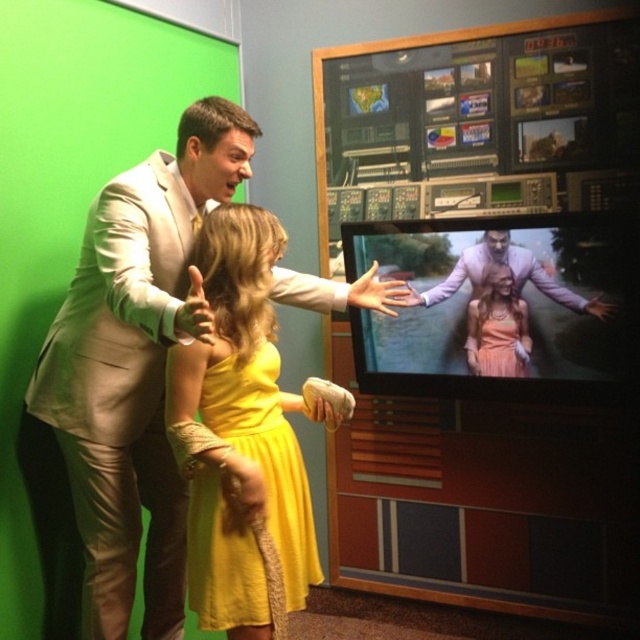
You are a costume designer reviewing a scene where two suits are displayed. The satin silver suit at upper left and the matte purple suit at center are part of the wardrobe. From the perspective of someone standing in front of the scene, which suit is closer to you?

The satin silver suit at upper left is closer because it is in front of the matte purple suit at center.

You are a costume designer preparing for a photoshoot. You need to place a new accessory between the satin silver suit at upper left and the matte purple suit at center. Based on their positions, which side of the accessory should be closer to the left edge of the image?

The satin silver suit at upper left is to the left of the matte purple suit at center, so the accessory should be placed closer to the left edge of the image near the satin silver suit at upper left.

You are a camera operator adjusting the focus on a zoom lens. The pink satin dress at center and the matte purple suit at center are both in your viewfinder. The minimum focus distance for your lens is 4 inches. Can you focus on both subjects simultaneously?

The pink satin dress at center is 4.20 inches away from the matte purple suit at center. Since the minimum focus distance is 4 inches, the subjects are just within the required range. Yes, you can focus on both the pink satin dress at center and the matte purple suit at center simultaneously.